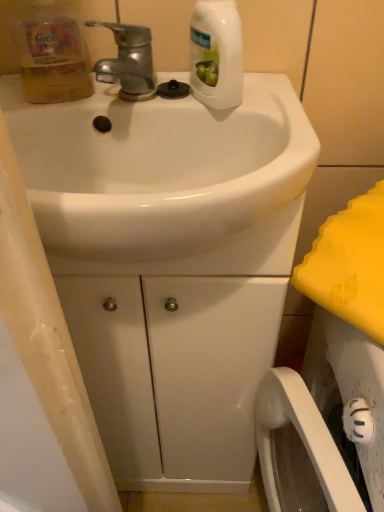
Question: Would you say white glossy bottle at upper center, marked as the first cleaning product in a right-to-left arrangement, is inside or outside white glossy sink at center?

Choices:
 (A) inside
 (B) outside

Answer: (B)

Question: In terms of height, does white glossy bottle at upper center, marked as the first cleaning product in a right-to-left arrangement, look taller or shorter compared to white glossy sink at center?

Choices:
 (A) tall
 (B) short

Answer: (A)

Question: Considering the real-world distances, which object is closest to the translucent yellow bottle at upper left, the 2th cleaning product viewed from the right?

Choices:
 (A) white glossy sink at center
 (B) white glossy bottle at upper center, which appears as the second cleaning product when viewed from the left
 (C) shiny metallic faucet at upper left

Answer: (C)

Question: Estimate the real-world distances between objects in this image. Which object is closer to the translucent yellow bottle at upper left, the 2th cleaning product viewed from the right?

Choices:
 (A) shiny metallic faucet at upper left
 (B) white glossy bottle at upper center, which appears as the second cleaning product when viewed from the left
 (C) white glossy sink at center

Answer: (A)